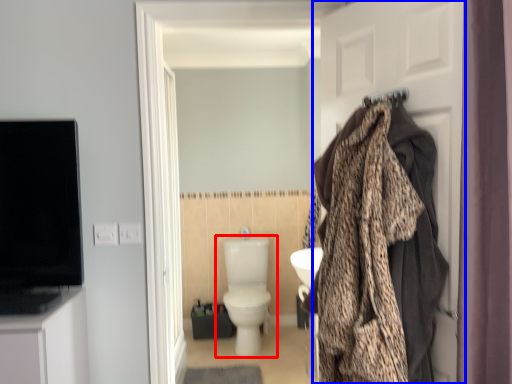
Question: Which object is further to the camera taking this photo, toilet (highlighted by a red box) or door (highlighted by a blue box)?

Choices:
 (A) toilet
 (B) door

Answer: (A)